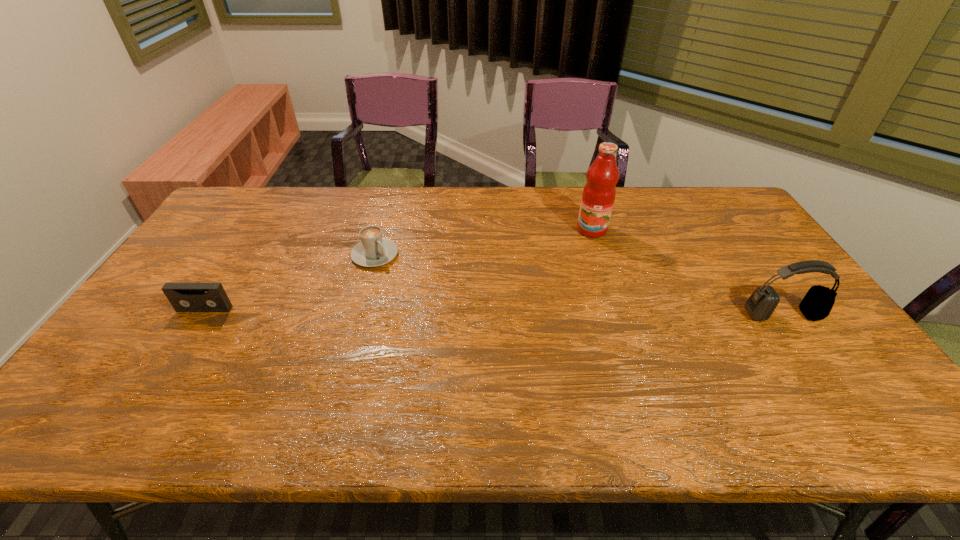
In the image, there is a desktop. At what (x,y) coordinates should I click in order to perform the action: click on vacant space at the left edge. Please return your answer as a coordinate pair (x, y). Image resolution: width=960 pixels, height=540 pixels. Looking at the image, I should click on (174, 278).

The height and width of the screenshot is (540, 960). What are the coordinates of `vacant space at the right edge of the desktop` in the screenshot? It's located at (716, 239).

This screenshot has width=960, height=540. I want to click on vacant space at the far left corner of the desktop, so click(229, 214).

The height and width of the screenshot is (540, 960). I want to click on vacant space that is in between the second object from left to right and the videotape, so click(x=290, y=282).

Where is `vacant space that is in between the second farthest object and the headset`? The image size is (960, 540). vacant space that is in between the second farthest object and the headset is located at coordinates (579, 285).

I want to click on vacant point located between the leftmost object and the third object from left to right, so click(x=398, y=269).

Where is `vacant area that lies between the rightmost object and the fruit juice`? This screenshot has height=540, width=960. vacant area that lies between the rightmost object and the fruit juice is located at coordinates (687, 272).

Identify the location of unoccupied area between the second object from left to right and the videotape. (290, 282).

Find the location of a particular element. The image size is (960, 540). vacant area that lies between the third nearest object and the leftmost object is located at coordinates (290, 282).

Where is `free space that is in between the second object from right to left and the videotape`? free space that is in between the second object from right to left and the videotape is located at coordinates (398, 269).